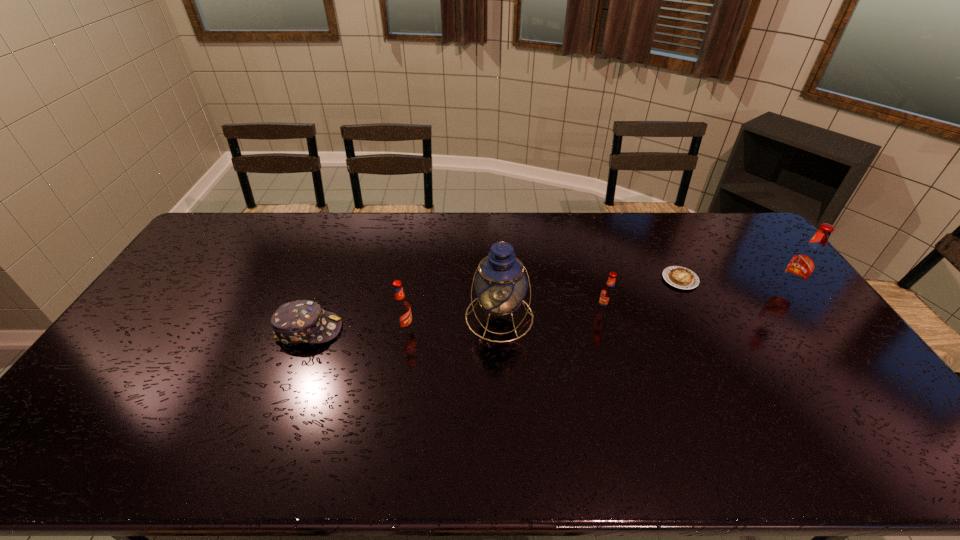
Image resolution: width=960 pixels, height=540 pixels. Identify the location of the leftmost object. (302, 321).

At what (x,y) coordinates should I click in order to perform the action: click on free space located on the back of the fourth shortest object. Please return your answer as a coordinate pair (x, y). Looking at the image, I should click on (409, 306).

Where is `vacant space located on the right of the shortest root beer`? This screenshot has height=540, width=960. vacant space located on the right of the shortest root beer is located at coordinates (656, 310).

This screenshot has width=960, height=540. Identify the location of vacant region located 0.370m on the left of the rightmost object. (661, 292).

Where is `vacant area situated on the left of the second object from right to left`? vacant area situated on the left of the second object from right to left is located at coordinates (630, 279).

What are the coordinates of `vacant space located 0.240m on the front-facing side of the lantern` in the screenshot? It's located at pyautogui.click(x=504, y=419).

Image resolution: width=960 pixels, height=540 pixels. I want to click on blank area located 0.300m on the front-facing side of the leftmost object, so click(x=443, y=330).

Image resolution: width=960 pixels, height=540 pixels. I want to click on object that is at the right edge, so click(802, 267).

This screenshot has height=540, width=960. In the image, there is a desktop. What are the coordinates of `blank space at the far edge` in the screenshot? It's located at (317, 227).

You are a GUI agent. You are given a task and a screenshot of the screen. Output one action in this format:
    pyautogui.click(x=<x>, y=<y>)
    Task: Click on the free spot at the near edge of the desktop
    The height and width of the screenshot is (540, 960).
    Given the screenshot: What is the action you would take?
    pyautogui.click(x=690, y=403)